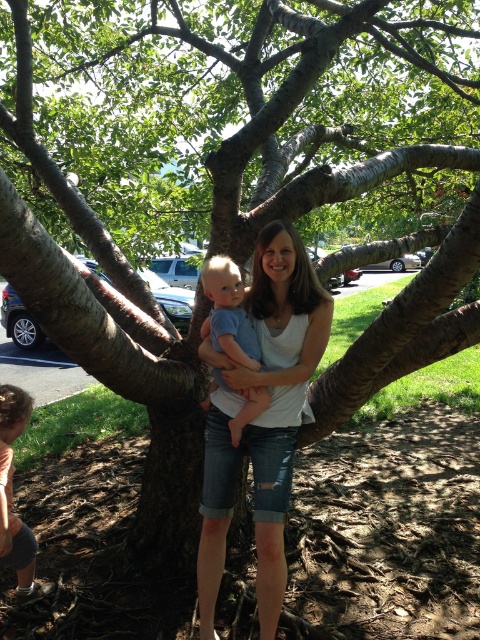
Based on the photo, you are a photographer trying to capture a clear shot of both the white cotton shirt at center and the blue cotton shirt at center. Since both are at the center, which one is closer to the camera?

The white cotton shirt at center is positioned under the blue cotton shirt at center, so the blue cotton shirt at center is closer to the camera.

You are a photographer trying to capture a closeup shot of the blue cotton shirt at center and the light brown hair at lower left. Which object should you zoom in on to ensure both are in focus without moving the camera?

To ensure both the blue cotton shirt at center and the light brown hair at lower left are in focus, you should zoom in on the blue cotton shirt at center since it is larger in size compared to the light brown hair at lower left, allowing for better focus adjustment.

You are a photographer planning to take a photo of two shirts displayed side by side. You have a white cotton shirt at center and a blue cotton shirt at center. Which shirt should you choose to be the focal point if you want the larger one to stand out more?

The white cotton shirt at center is larger in size than the blue cotton shirt at center, so you should choose the white cotton shirt at center as the focal point to make it stand out more.